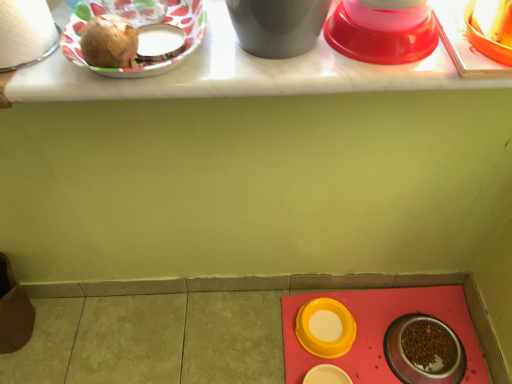
Question: From a real-world perspective, is yellow matte bowl at lower center, which is the 6th tableware in top-to-bottom order, below matte plastic plate at upper left, which is the fourth tableware in bottom-to-top order?

Choices:
 (A) yes
 (B) no

Answer: (A)

Question: Is yellow matte bowl at lower center, which is the third tableware from left to right, not near matte plastic plate at upper left, arranged as the fifth tableware when viewed from the right?

Choices:
 (A) yes
 (B) no

Answer: (B)

Question: Is yellow matte bowl at lower center, which is the second tableware from back to front, facing away from matte plastic plate at upper left, arranged as the fifth tableware when viewed from the right?

Choices:
 (A) yes
 (B) no

Answer: (B)

Question: Does yellow matte bowl at lower center, the 1th tableware when ordered from bottom to top, have a greater width compared to matte plastic plate at upper left, which appears as the third tableware when viewed from the top?

Choices:
 (A) no
 (B) yes

Answer: (B)

Question: Is yellow matte bowl at lower center, which is the 5th tableware in front-to-back order, positioned behind matte plastic plate at upper left, which appears as the 2th tableware when viewed from the left?

Choices:
 (A) yes
 (B) no

Answer: (A)

Question: Is yellow matte bowl at lower center, which is the 5th tableware in front-to-back order, not inside matte plastic plate at upper left, which appears as the 2th tableware when viewed from the left?

Choices:
 (A) no
 (B) yes

Answer: (B)

Question: Are shiny plastic bowl at upper right, the third tableware when ordered from right to left, and matte plastic plate at upper left, which is the fifth tableware from bottom to top, located far from each other?

Choices:
 (A) yes
 (B) no

Answer: (B)

Question: Considering the relative sizes of shiny plastic bowl at upper right, which is counted as the second tableware, starting from the front, and matte plastic plate at upper left, arranged as the sixth tableware when viewed from the right, in the image provided, is shiny plastic bowl at upper right, which is counted as the second tableware, starting from the front, taller than matte plastic plate at upper left, arranged as the sixth tableware when viewed from the right,?

Choices:
 (A) yes
 (B) no

Answer: (B)

Question: Does shiny plastic bowl at upper right, which is counted as the second tableware, starting from the front, come in front of matte plastic plate at upper left, which is the 6th tableware in back-to-front order?

Choices:
 (A) no
 (B) yes

Answer: (A)

Question: Is shiny plastic bowl at upper right, the 4th tableware viewed from the left, with matte plastic plate at upper left, arranged as the sixth tableware when viewed from the right?

Choices:
 (A) no
 (B) yes

Answer: (A)

Question: From the image's perspective, would you say shiny plastic bowl at upper right, which is counted as the second tableware, starting from the front, is shown under matte plastic plate at upper left, placed as the 1th tableware when sorted from front to back?

Choices:
 (A) no
 (B) yes

Answer: (A)

Question: Is shiny plastic bowl at upper right, which is counted as the second tableware, starting from the front, to the left of matte plastic plate at upper left, which is the 6th tableware in back-to-front order, from the viewer's perspective?

Choices:
 (A) yes
 (B) no

Answer: (B)

Question: Considering the relative sizes of white matte toilet paper at upper left and matte white table at upper center in the image provided, is white matte toilet paper at upper left wider than matte white table at upper center?

Choices:
 (A) yes
 (B) no

Answer: (B)